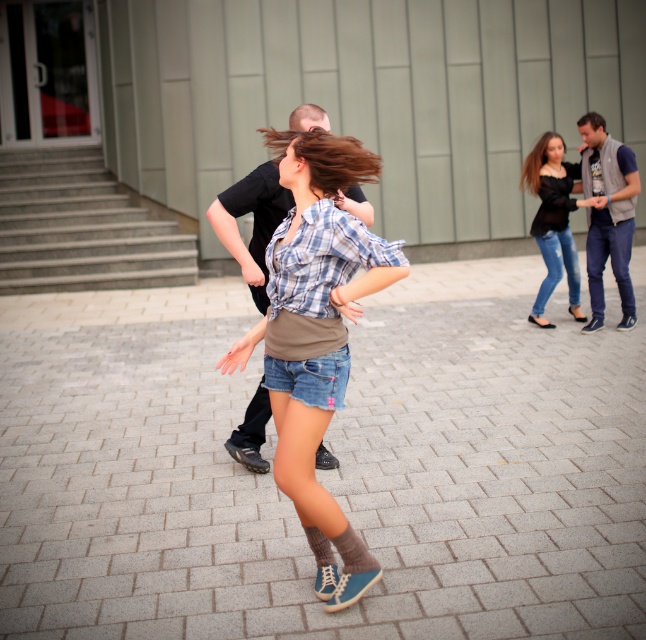
Question: Which object is farther from the camera taking this photo?

Choices:
 (A) denim shorts at center
 (B) blonde silky hair at upper right
 (C) smooth brown hair at upper right
 (D) black matte shirt at upper right

Answer: (B)

Question: Does denim shorts at center have a greater width compared to gray wool vest at right?

Choices:
 (A) no
 (B) yes

Answer: (B)

Question: Can you confirm if denim shorts at center is thinner than smooth brown hair at upper right?

Choices:
 (A) yes
 (B) no

Answer: (B)

Question: Which point is closer to the camera?

Choices:
 (A) denim shorts at center
 (B) gray brick pavement at center

Answer: (B)

Question: Is gray wool vest at right positioned behind brown matte hair at center?

Choices:
 (A) yes
 (B) no

Answer: (A)

Question: Which of the following is the closest to the observer?

Choices:
 (A) (331, 180)
 (B) (289, 256)
 (C) (623, 307)
 (D) (587, 122)

Answer: (B)